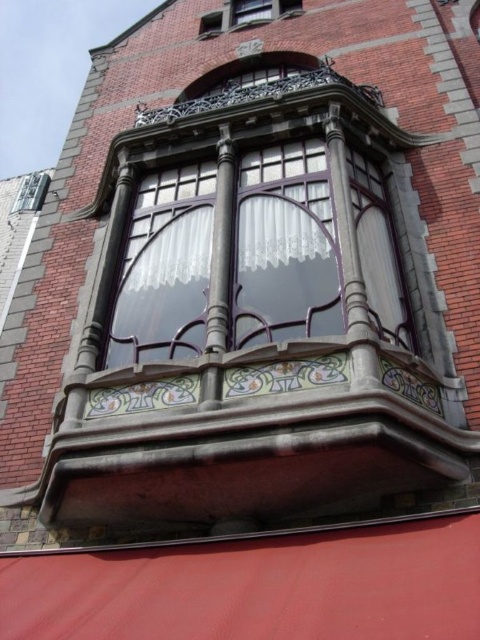
Is point (297, 296) positioned before point (272, 12)?

Yes.

Consider the image. Does matte glass window at center appear under matte glass window at upper center?

Indeed, matte glass window at center is positioned under matte glass window at upper center.

Image resolution: width=480 pixels, height=640 pixels. What do you see at coordinates (253, 253) in the screenshot?
I see `matte glass window at center` at bounding box center [253, 253].

Find the location of a particular element. matte glass window at center is located at coordinates (253, 253).